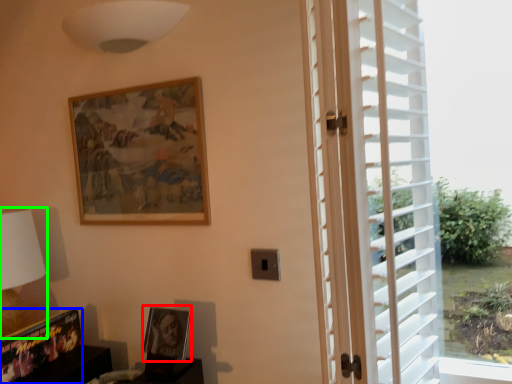
Question: Considering the real-world distances, which object is closest to picture frame (highlighted by a red box)? picture frame (highlighted by a blue box) or table lamp (highlighted by a green box).

Choices:
 (A) picture frame
 (B) table lamp

Answer: (A)